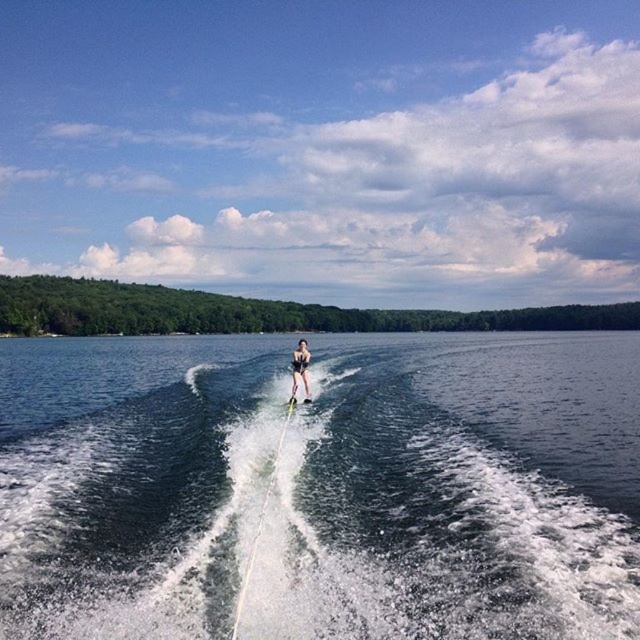
Question: Which object is closer to the camera taking this photo?

Choices:
 (A) black swimsuit at center
 (B) clear blue water at center

Answer: (B)

Question: Can you confirm if clear blue water at center is smaller than black swimsuit at center?

Choices:
 (A) yes
 (B) no

Answer: (B)

Question: Is clear blue water at center closer to camera compared to black swimsuit at center?

Choices:
 (A) yes
 (B) no

Answer: (A)

Question: Can you confirm if clear blue water at center is thinner than black swimsuit at center?

Choices:
 (A) yes
 (B) no

Answer: (B)

Question: Which of the following is the farthest from the observer?

Choices:
 (A) (97, 618)
 (B) (301, 348)

Answer: (B)